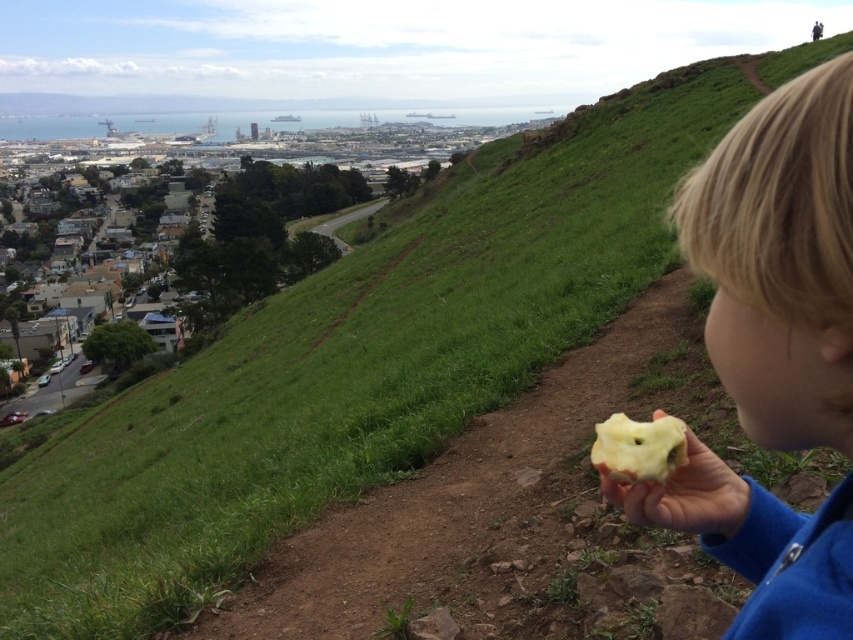
Question: Where is blonde hair at upper right located in relation to yellow matte apple at lower right in the image?

Choices:
 (A) above
 (B) below

Answer: (A)

Question: Which point is farther to the camera?

Choices:
 (A) blonde hair at upper right
 (B) yellow matte apple at right
 (C) yellow matte apple at lower right

Answer: (B)

Question: Is blonde hair at upper right positioned before yellow matte apple at lower right?

Choices:
 (A) no
 (B) yes

Answer: (B)

Question: Which point is closer to the camera?

Choices:
 (A) yellow matte apple at lower right
 (B) blonde hair at upper right
 (C) yellow matte apple at right

Answer: (B)

Question: Can you confirm if blonde hair at upper right is thinner than yellow matte apple at right?

Choices:
 (A) yes
 (B) no

Answer: (B)

Question: Which object appears closest to the camera in this image?

Choices:
 (A) blonde hair at upper right
 (B) yellow matte apple at right
 (C) yellow matte apple at lower right

Answer: (A)